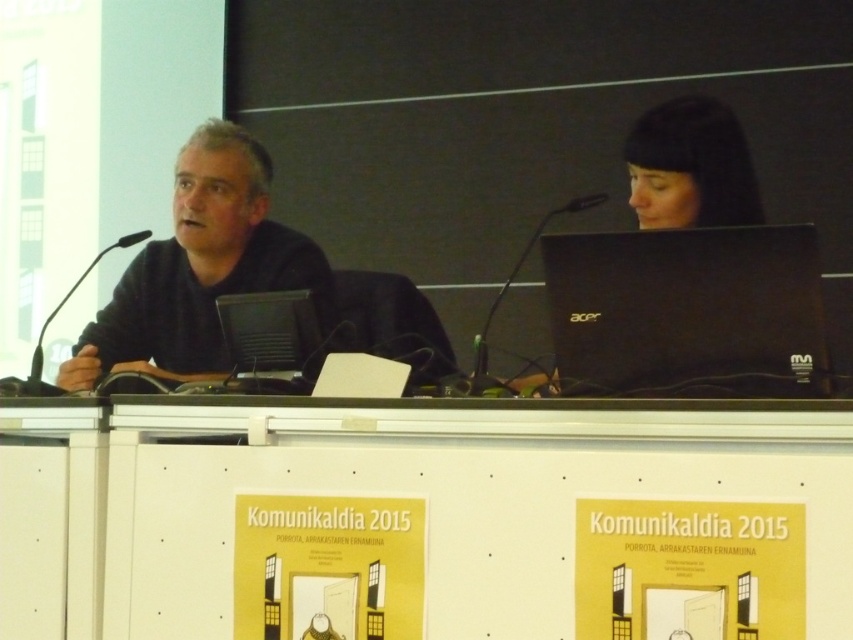
Question: Which of the following is the closest to the observer?

Choices:
 (A) white matte table at lower center
 (B) black plastic microphone at left
 (C) black plastic microphone at center

Answer: (A)

Question: Is black matte shirt at left further to camera compared to black plastic laptop at center?

Choices:
 (A) yes
 (B) no

Answer: (A)

Question: Which point is closer to the camera?

Choices:
 (A) [x=635, y=180]
 (B) [x=207, y=188]
 (C) [x=621, y=317]

Answer: (C)

Question: Which object is closer to the camera taking this photo?

Choices:
 (A) black matte hair at upper center
 (B) black matte laptop at center
 (C) black plastic microphone at left
 (D) black plastic microphone at center

Answer: (B)

Question: Is black matte shirt at left behind black plastic microphone at center?

Choices:
 (A) no
 (B) yes

Answer: (A)

Question: Can you confirm if black matte shirt at left is wider than black plastic microphone at center?

Choices:
 (A) no
 (B) yes

Answer: (B)